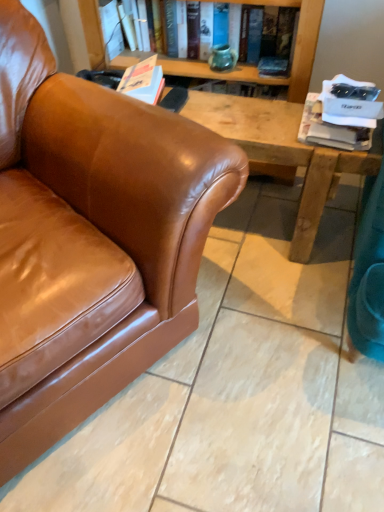
Question: Does brown leather couch at left come in front of matte green vase at upper center, arranged as the second book when ordered from the bottom?

Choices:
 (A) yes
 (B) no

Answer: (A)

Question: Is brown leather couch at left facing towards matte green vase at upper center, the second book positioned from the right?

Choices:
 (A) no
 (B) yes

Answer: (A)

Question: Considering the relative sizes of brown leather couch at left and matte green vase at upper center, the second book positioned from the right, in the image provided, is brown leather couch at left bigger than matte green vase at upper center, the second book positioned from the right,?

Choices:
 (A) yes
 (B) no

Answer: (A)

Question: Does brown leather couch at left have a lesser width compared to matte green vase at upper center, which is counted as the 2th book, starting from the front?

Choices:
 (A) yes
 (B) no

Answer: (B)

Question: Can you confirm if brown leather couch at left is shorter than matte green vase at upper center, positioned as the 1th book in left-to-right order?

Choices:
 (A) yes
 (B) no

Answer: (B)

Question: Is matte green vase at upper center, marked as the 1th book in a back-to-front arrangement, completely or partially inside brown leather couch at left?

Choices:
 (A) no
 (B) yes

Answer: (A)

Question: Does brown leather couch at left have a greater width compared to white paper at upper right, placed as the 2th book when sorted from top to bottom?

Choices:
 (A) no
 (B) yes

Answer: (B)

Question: Does brown leather couch at left have a larger size compared to white paper at upper right, the 1th book viewed from the right?

Choices:
 (A) yes
 (B) no

Answer: (A)

Question: Is brown leather couch at left not within white paper at upper right, placed as the 2th book when sorted from top to bottom?

Choices:
 (A) yes
 (B) no

Answer: (A)

Question: From a real-world perspective, does brown leather couch at left sit lower than white paper at upper right, the 1th book viewed from the right?

Choices:
 (A) no
 (B) yes

Answer: (A)

Question: Can you confirm if brown leather couch at left is thinner than white paper at upper right, marked as the 2th book in a back-to-front arrangement?

Choices:
 (A) yes
 (B) no

Answer: (B)

Question: Is brown leather couch at left shorter than white paper at upper right, placed as the 2th book when sorted from top to bottom?

Choices:
 (A) no
 (B) yes

Answer: (A)

Question: Considering the relative sizes of matte green vase at upper center, the 1th book viewed from the top, and white paper at upper right, acting as the 2th book starting from the left, in the image provided, is matte green vase at upper center, the 1th book viewed from the top, smaller than white paper at upper right, acting as the 2th book starting from the left,?

Choices:
 (A) no
 (B) yes

Answer: (A)